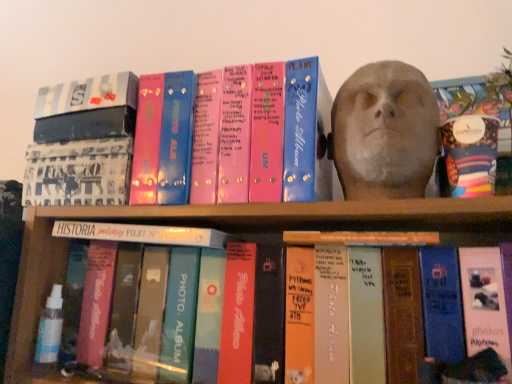
Measure the distance between pink glossy photo album at upper center, which is counted as the third book, starting from the bottom, and camera.

The depth of pink glossy photo album at upper center, which is counted as the third book, starting from the bottom, is 24.43 inches.

The image size is (512, 384). I want to click on white matte book at center, arranged as the third book when viewed from the top, so click(x=141, y=234).

Identify the location of orange matte book at center, positioned as the 2th book in top-to-bottom order. (361, 238).

You are a GUI agent. You are given a task and a screenshot of the screen. Output one action in this format:
    pyautogui.click(x=<x>, y=<y>)
    Task: Click on the multicolored fabric bag at upper right
    
    Given the screenshot: What is the action you would take?
    pyautogui.click(x=470, y=154)

Is matte gray bust at upper right directly adjacent to white textured fabric album at upper left?

They are not placed beside each other.

Between matte gray bust at upper right and white textured fabric album at upper left, which one has smaller width?

white textured fabric album at upper left is thinner.

What's the angular difference between matte gray bust at upper right and white textured fabric album at upper left's facing directions?

The angle between the facing direction of matte gray bust at upper right and the facing direction of white textured fabric album at upper left is 0.00033 degrees.

Based on their sizes in the image, would you say matte gray bust at upper right is bigger or smaller than white textured fabric album at upper left?

Considering their sizes, matte gray bust at upper right takes up more space than white textured fabric album at upper left.

Who is taller, pink glossy photo album at upper center, which appears as the first book when viewed from the top, or matte gray bust at upper right?

matte gray bust at upper right is taller.

Which is in front, point (38, 159) or point (382, 100)?

The point (382, 100) is closer to the camera.

At what (x,y) coordinates should I click in order to perform the action: click on the 1st book below when counting from the matte gray bust at upper right (from the image's perspective). Please return your answer as a coordinate pair (x, y). The height and width of the screenshot is (384, 512). Looking at the image, I should click on (189, 139).

Considering the positions of objects pink glossy photo album at upper center, which appears as the first book when viewed from the top, and matte gray bust at upper right in the image provided, who is more to the right, pink glossy photo album at upper center, which appears as the first book when viewed from the top, or matte gray bust at upper right?

matte gray bust at upper right.

Is white textured fabric album at upper left outside of pink glossy photo album at upper center, which appears as the first book when viewed from the top?

white textured fabric album at upper left lies outside pink glossy photo album at upper center, which appears as the first book when viewed from the top,'s area.

Is white textured fabric album at upper left wider than pink glossy photo album at upper center, which appears as the first book when viewed from the top?

Indeed, white textured fabric album at upper left has a greater width compared to pink glossy photo album at upper center, which appears as the first book when viewed from the top.

Based on the photo, can you see white matte book at center, arranged as the third book when viewed from the top, touching orange matte book at center, positioned as the 2th book in top-to-bottom order?

There is a gap between white matte book at center, arranged as the third book when viewed from the top, and orange matte book at center, positioned as the 2th book in top-to-bottom order.

Does point (211, 235) lie behind point (316, 233)?

Yes, point (211, 235) is farther from viewer.

Is white matte book at center, the 1th book from the bottom, aimed at orange matte book at center, the 2th book in the bottom-to-top sequence?

No, white matte book at center, the 1th book from the bottom, is not facing towards orange matte book at center, the 2th book in the bottom-to-top sequence.

From a real-world perspective, relative to orange matte book at center, positioned as the 2th book in top-to-bottom order, is white matte book at center, the 1th book from the bottom, vertically above or below?

white matte book at center, the 1th book from the bottom, is above orange matte book at center, positioned as the 2th book in top-to-bottom order.

From a real-world perspective, which book is the 2nd one underneath the pink glossy photo album at upper center, which appears as the first book when viewed from the top? Please provide its 2D coordinates.

[(361, 238)]

Is pink glossy photo album at upper center, which appears as the first book when viewed from the top, not within orange matte book at center, positioned as the 2th book in top-to-bottom order?

That's correct, pink glossy photo album at upper center, which appears as the first book when viewed from the top, is outside of orange matte book at center, positioned as the 2th book in top-to-bottom order.

Consider the image. Considering the sizes of objects pink glossy photo album at upper center, which is counted as the third book, starting from the bottom, and orange matte book at center, positioned as the 2th book in top-to-bottom order, in the image provided, who is bigger, pink glossy photo album at upper center, which is counted as the third book, starting from the bottom, or orange matte book at center, positioned as the 2th book in top-to-bottom order,?

pink glossy photo album at upper center, which is counted as the third book, starting from the bottom, is bigger.

Can you confirm if pink glossy photo album at upper center, which appears as the first book when viewed from the top, is taller than orange matte book at center, positioned as the 2th book in top-to-bottom order?

Yes.

From a real-world perspective, relative to matte gray bust at upper right, is orange matte book at center, positioned as the 2th book in top-to-bottom order, vertically above or below?

In terms of real-world spatial position, orange matte book at center, positioned as the 2th book in top-to-bottom order, is below matte gray bust at upper right.

In the scene shown: Does orange matte book at center, the 2th book in the bottom-to-top sequence, turn towards matte gray bust at upper right?

No, orange matte book at center, the 2th book in the bottom-to-top sequence, is not facing towards matte gray bust at upper right.

What's the angular difference between orange matte book at center, positioned as the 2th book in top-to-bottom order, and matte gray bust at upper right's facing directions?

5.31e-05 degrees separate the facing orientations of orange matte book at center, positioned as the 2th book in top-to-bottom order, and matte gray bust at upper right.

From the image's perspective, is multicolored fabric bag at upper right located above or below orange matte book at center, positioned as the 2th book in top-to-bottom order?

multicolored fabric bag at upper right is above orange matte book at center, positioned as the 2th book in top-to-bottom order.

Considering the positions of points (486, 168) and (346, 241), is point (486, 168) closer to camera compared to point (346, 241)?

Yes.

From a real-world perspective, between multicolored fabric bag at upper right and orange matte book at center, positioned as the 2th book in top-to-bottom order, who is vertically lower?

In real-world perspective, orange matte book at center, positioned as the 2th book in top-to-bottom order, is lower.

Does multicolored fabric bag at upper right turn towards orange matte book at center, the 2th book in the bottom-to-top sequence?

No, multicolored fabric bag at upper right is not aimed at orange matte book at center, the 2th book in the bottom-to-top sequence.

Find the location of a particular element. This screenshot has height=384, width=512. book cover located on the left of matte gray bust at upper right is located at coordinates (78, 172).

Find the location of a particular element. human face to the right of pink glossy photo album at upper center, which is counted as the third book, starting from the bottom is located at coordinates (385, 128).

Looking at the image, which one is located further to white matte book at center, arranged as the third book when viewed from the top, pink glossy photo album at upper center, which is counted as the third book, starting from the bottom, or multicolored fabric bag at upper right?

multicolored fabric bag at upper right.

When comparing their distances from white textured fabric album at upper left, does pink glossy photo album at upper center, which appears as the first book when viewed from the top, or multicolored fabric bag at upper right seem closer?

pink glossy photo album at upper center, which appears as the first book when viewed from the top, is positioned closer to the anchor white textured fabric album at upper left.

Looking at the image, which one is located further to matte gray bust at upper right, white textured fabric album at upper left or pink glossy photo album at upper center, which is counted as the third book, starting from the bottom?

white textured fabric album at upper left.

Which object lies further to the anchor point pink glossy photo album at upper center, which appears as the first book when viewed from the top, orange matte book at center, the 2th book in the bottom-to-top sequence, or multicolored fabric bag at upper right?

multicolored fabric bag at upper right lies further to pink glossy photo album at upper center, which appears as the first book when viewed from the top, than the other object.

Looking at the image, which one is located further to matte gray bust at upper right, multicolored fabric bag at upper right or white textured fabric album at upper left?

The object further to matte gray bust at upper right is white textured fabric album at upper left.

Estimate the real-world distances between objects in this image. Which object is closer to multicolored fabric bag at upper right, orange matte book at center, the 2th book in the bottom-to-top sequence, or matte gray bust at upper right?

matte gray bust at upper right is positioned closer to the anchor multicolored fabric bag at upper right.

When comparing their distances from multicolored fabric bag at upper right, does white matte book at center, the 1th book from the bottom, or matte gray bust at upper right seem closer?

matte gray bust at upper right is closer to multicolored fabric bag at upper right.

Looking at the image, which one is located further to matte gray bust at upper right, orange matte book at center, the 2th book in the bottom-to-top sequence, or white matte book at center, arranged as the third book when viewed from the top?

Among the two, white matte book at center, arranged as the third book when viewed from the top, is located further to matte gray bust at upper right.

The width and height of the screenshot is (512, 384). In order to click on book between white matte book at center, arranged as the third book when viewed from the top, and orange matte book at center, positioned as the 2th book in top-to-bottom order, from left to right in this screenshot , I will do `click(189, 139)`.

In order to click on book situated between pink glossy photo album at upper center, which appears as the first book when viewed from the top, and multicolored fabric bag at upper right from left to right in this screenshot , I will do `click(361, 238)`.

Locate an element on the screen. human face between white matte book at center, the 1th book from the bottom, and multicolored fabric bag at upper right, in the horizontal direction is located at coordinates coord(385,128).

This screenshot has height=384, width=512. What are the coordinates of `book located between white textured fabric album at upper left and pink glossy photo album at upper center, which appears as the first book when viewed from the top, in the left-right direction` in the screenshot? It's located at (141, 234).